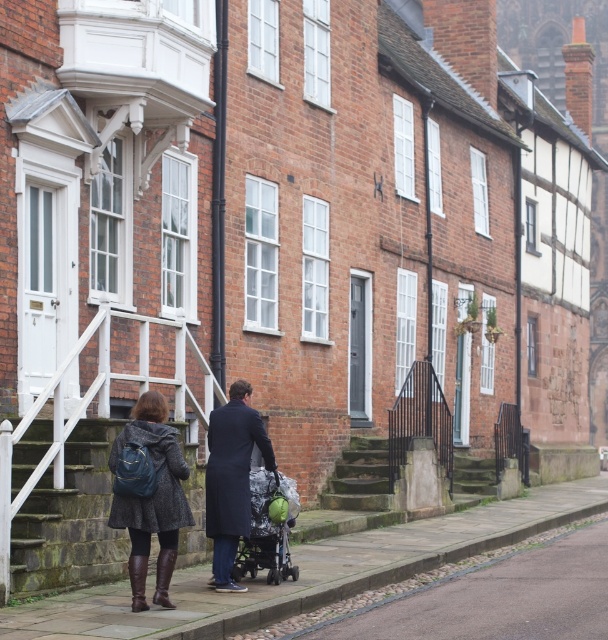
Is smooth concrete pavement at lower center bigger than dark gray textured coat at center?

Indeed, smooth concrete pavement at lower center has a larger size compared to dark gray textured coat at center.

This screenshot has height=640, width=608. I want to click on smooth concrete pavement at lower center, so click(x=477, y=596).

Is dark blue wool coat at center further to camera compared to green fabric baby carriage at center?

No, dark blue wool coat at center is closer to the viewer.

Can you confirm if dark blue wool coat at center is positioned above green fabric baby carriage at center?

Yes.

Find the location of a particular element. The height and width of the screenshot is (640, 608). dark blue wool coat at center is located at coordinates (232, 477).

Where is `dark blue wool coat at center`? This screenshot has height=640, width=608. dark blue wool coat at center is located at coordinates (232, 477).

Can you confirm if paved stone sidewalk at center is thinner than dark gray textured coat at center?

No.

Can you confirm if paved stone sidewalk at center is shorter than dark gray textured coat at center?

Yes, paved stone sidewalk at center is shorter than dark gray textured coat at center.

Which is in front, point (111, 618) or point (153, 420)?

Point (111, 618)

Where is `paved stone sidewalk at center`? This screenshot has width=608, height=640. paved stone sidewalk at center is located at coordinates (308, 572).